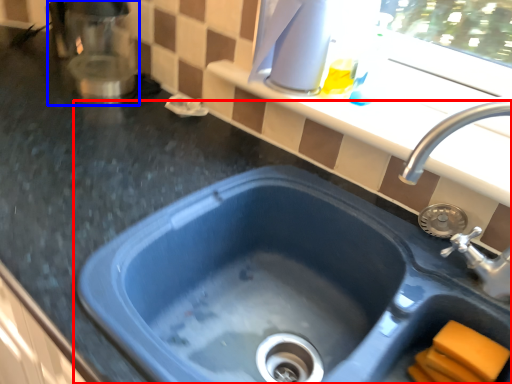
Question: Which of the following is the farthest to the observer, sink (highlighted by a red box) or appliance (highlighted by a blue box)?

Choices:
 (A) sink
 (B) appliance

Answer: (B)